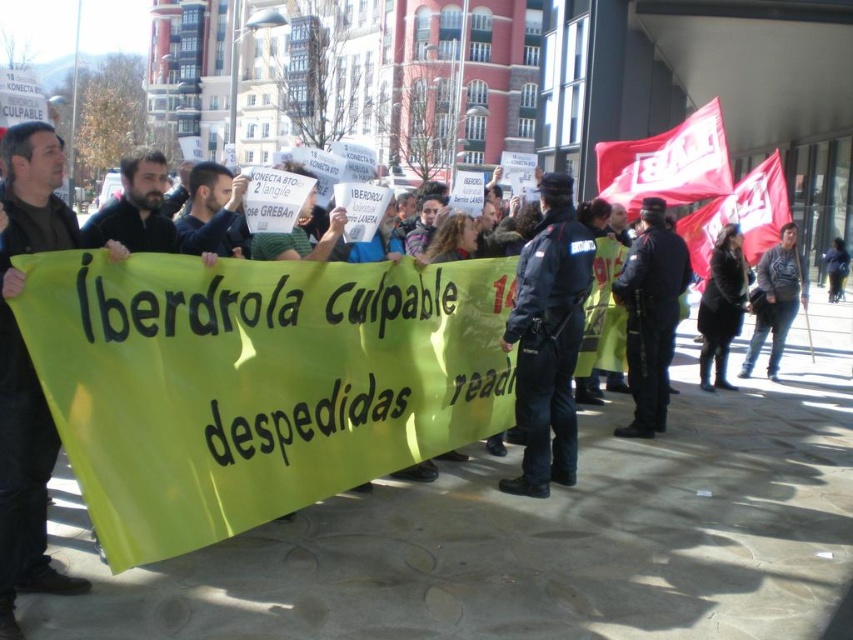
You are a journalist at the protest scene. You need to take a photo for your article that includes both the black uniformed officer at center and the dark blue jacket at center. The camera you have can only focus on objects of a certain size. Considering their sizes, which object should you ensure is in focus to capture both clearly?

Since the black uniformed officer at center is larger in size than the dark blue jacket at center, you should focus on the black uniformed officer at center to ensure both are in focus, as the larger object will be more likely to stay sharp in the photo.

You are a photographer trying to capture a clear shot of the protesters. You notice two dark blue items at the center of the scene. Which one is wider, the dark blue uniform at center or the dark blue jacket at center?

The dark blue uniform at center is wider than the dark blue jacket at center.